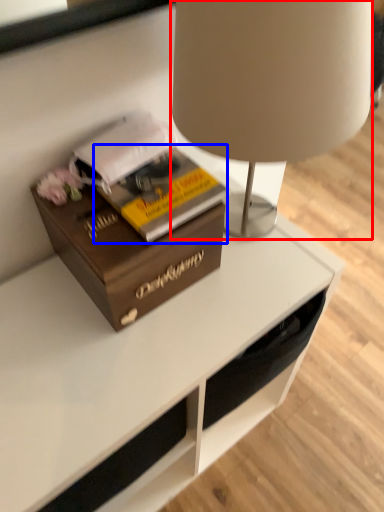
Question: Among these objects, which one is nearest to the camera, lamp (highlighted by a red box) or paperback book (highlighted by a blue box)?

Choices:
 (A) lamp
 (B) paperback book

Answer: (A)